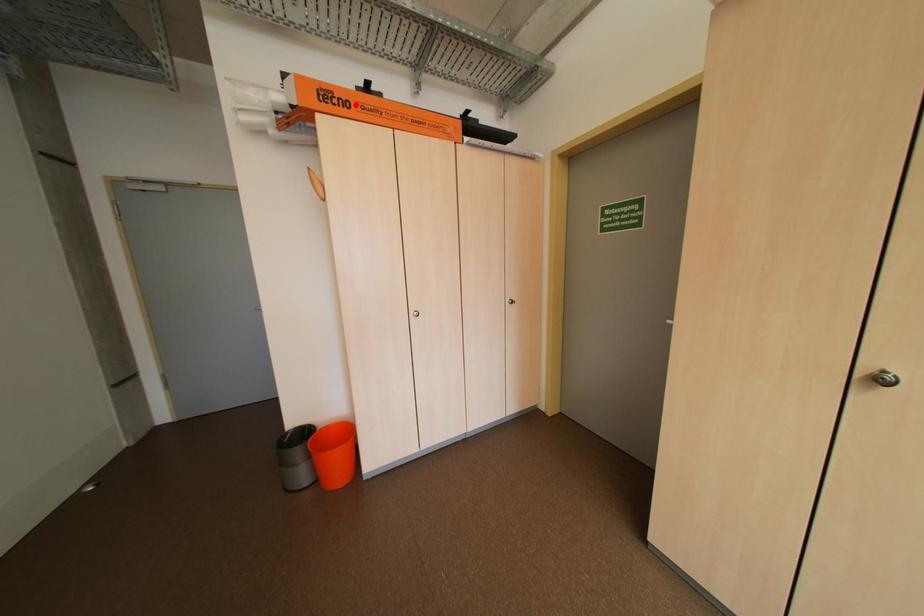
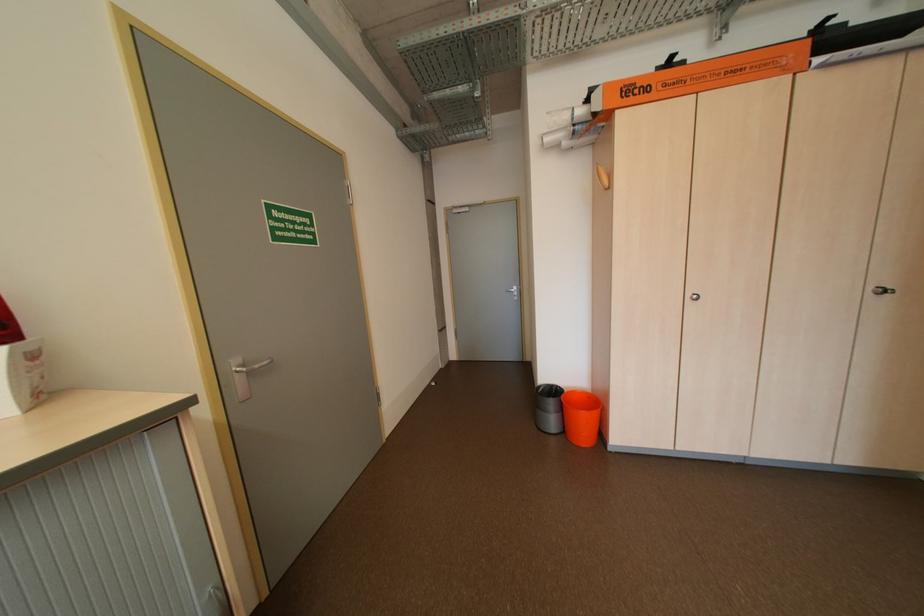
Locate, in the second image, the point that corresponds to the highlighted location in the first image.

(655, 90)